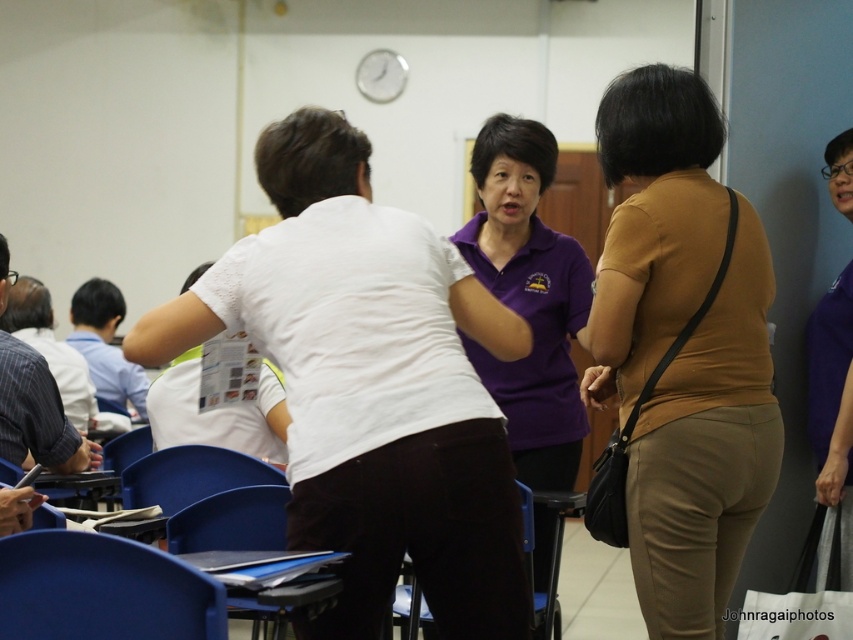
Can you confirm if matte brown blouse at center is thinner than white fabric shopping bag at lower right?

No, matte brown blouse at center is not thinner than white fabric shopping bag at lower right.

Which is in front, point (680, 349) or point (840, 625)?

Positioned in front is point (680, 349).

At what (x,y) coordinates should I click in order to perform the action: click on matte brown blouse at center. Please return your answer as a coordinate pair (x, y). Looking at the image, I should click on (706, 452).

Is blue plastic chair at lower left smaller than blue plastic chair at lower center?

Indeed, blue plastic chair at lower left has a smaller size compared to blue plastic chair at lower center.

Is point (109, 552) more distant than point (332, 589)?

No, it is in front of (332, 589).

Is point (78, 636) farther from camera compared to point (268, 518)?

No, it is not.

Find the location of a particular element. The image size is (853, 640). blue plastic chair at lower left is located at coordinates (102, 589).

Can you confirm if purple matte shirt at center is positioned to the right of white fabric shopping bag at lower right?

Incorrect, purple matte shirt at center is not on the right side of white fabric shopping bag at lower right.

Does purple matte shirt at center appear over white fabric shopping bag at lower right?

Yes.

Between point (553, 522) and point (793, 636), which one is positioned in front?

Point (793, 636) is more forward.

Find the location of a particular element. purple matte shirt at center is located at coordinates (527, 300).